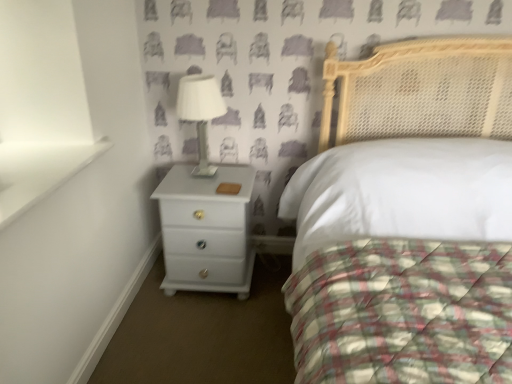
Question: Considering the relative positions of white glossy bed at center and white glossy table lamp at upper center in the image provided, is white glossy bed at center in front of white glossy table lamp at upper center?

Choices:
 (A) yes
 (B) no

Answer: (A)

Question: From a real-world perspective, is white glossy bed at center on white glossy table lamp at upper center?

Choices:
 (A) no
 (B) yes

Answer: (A)

Question: From the image's perspective, does white glossy bed at center appear higher than white glossy table lamp at upper center?

Choices:
 (A) yes
 (B) no

Answer: (B)

Question: From a real-world perspective, is white glossy bed at center positioned under white glossy table lamp at upper center based on gravity?

Choices:
 (A) yes
 (B) no

Answer: (A)

Question: Are white glossy bed at center and white glossy table lamp at upper center making contact?

Choices:
 (A) yes
 (B) no

Answer: (B)

Question: Can you confirm if white glossy bed at center is positioned to the right of white glossy table lamp at upper center?

Choices:
 (A) yes
 (B) no

Answer: (A)

Question: Is white glossy table lamp at upper center shorter than white glossy bed at center?

Choices:
 (A) yes
 (B) no

Answer: (A)

Question: Is white glossy table lamp at upper center taller than white glossy bed at center?

Choices:
 (A) no
 (B) yes

Answer: (A)

Question: Is white glossy table lamp at upper center not close to white glossy bed at center?

Choices:
 (A) yes
 (B) no

Answer: (A)

Question: From the image's perspective, is white glossy table lamp at upper center located above white glossy bed at center?

Choices:
 (A) yes
 (B) no

Answer: (A)

Question: Can you confirm if white glossy table lamp at upper center is bigger than white glossy bed at center?

Choices:
 (A) yes
 (B) no

Answer: (B)

Question: Does white glossy table lamp at upper center have a lesser width compared to white glossy bed at center?

Choices:
 (A) no
 (B) yes

Answer: (B)

Question: Is white glossy table lamp at upper center not near white glossy chest of drawers at lower left?

Choices:
 (A) no
 (B) yes

Answer: (A)